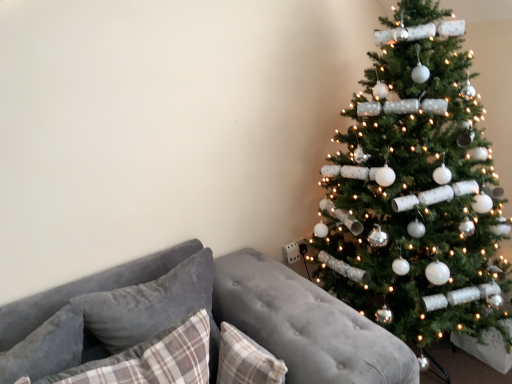
Question: Does plaid fabric pillow at lower left, which is the third pillow in left-to-right order, have a larger size compared to velvet gray couch at lower left?

Choices:
 (A) yes
 (B) no

Answer: (B)

Question: Is plaid fabric pillow at lower left, which is the third pillow in left-to-right order, to the left of velvet gray couch at lower left from the viewer's perspective?

Choices:
 (A) yes
 (B) no

Answer: (A)

Question: Is plaid fabric pillow at lower left, which is the third pillow in left-to-right order, smaller than velvet gray couch at lower left?

Choices:
 (A) yes
 (B) no

Answer: (A)

Question: Does plaid fabric pillow at lower left, which is the third pillow in left-to-right order, have a greater width compared to velvet gray couch at lower left?

Choices:
 (A) no
 (B) yes

Answer: (A)

Question: From the image's perspective, is plaid fabric pillow at lower left, which is counted as the 2th pillow, starting from the right, over velvet gray couch at lower left?

Choices:
 (A) yes
 (B) no

Answer: (A)

Question: Does plaid fabric pillow at lower left, which is the third pillow in left-to-right order, turn towards velvet gray couch at lower left?

Choices:
 (A) yes
 (B) no

Answer: (A)

Question: From the image's perspective, is plaid fabric pillow at center, which appears as the 1th pillow when viewed from the right, over velvet gray couch at lower left?

Choices:
 (A) no
 (B) yes

Answer: (B)

Question: Are plaid fabric pillow at center, which appears as the 1th pillow when viewed from the right, and velvet gray couch at lower left located far from each other?

Choices:
 (A) no
 (B) yes

Answer: (A)

Question: Considering the relative positions of plaid fabric pillow at center, which appears as the 1th pillow when viewed from the right, and velvet gray couch at lower left in the image provided, is plaid fabric pillow at center, which appears as the 1th pillow when viewed from the right, to the right of velvet gray couch at lower left from the viewer's perspective?

Choices:
 (A) yes
 (B) no

Answer: (A)

Question: From a real-world perspective, is plaid fabric pillow at center, which appears as the 1th pillow when viewed from the right, physically above velvet gray couch at lower left?

Choices:
 (A) no
 (B) yes

Answer: (B)

Question: Is velvet gray couch at lower left at the back of plaid fabric pillow at center, which appears as the 1th pillow when viewed from the right?

Choices:
 (A) no
 (B) yes

Answer: (B)

Question: Considering the relative positions of plaid fabric pillow at center, which appears as the 1th pillow when viewed from the right, and velvet gray couch at lower left in the image provided, is plaid fabric pillow at center, which appears as the 1th pillow when viewed from the right, to the left of velvet gray couch at lower left from the viewer's perspective?

Choices:
 (A) no
 (B) yes

Answer: (A)

Question: Is velvety gray pillow at left, which is the second pillow from left to right, positioned with its back to plaid fabric pillow at lower left, which is counted as the 2th pillow, starting from the right?

Choices:
 (A) no
 (B) yes

Answer: (A)